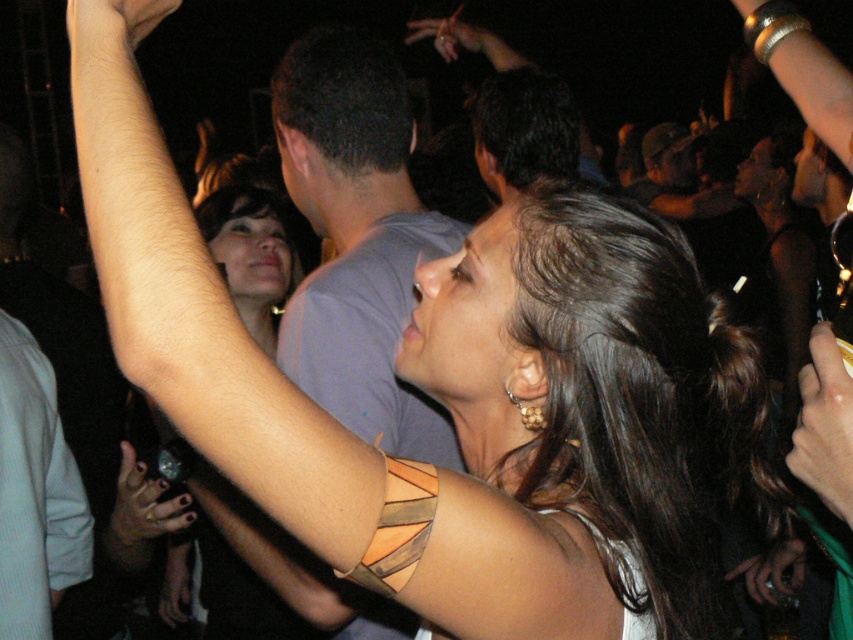
Question: Does smooth gold bracelet at upper right appear under smooth metallic bracelet at upper left?

Choices:
 (A) no
 (B) yes

Answer: (B)

Question: Which point is closer to the camera?

Choices:
 (A) (813, 346)
 (B) (421, 35)

Answer: (A)

Question: Can you confirm if leather bracelet at upper left is positioned below polished silver ring at upper left?

Choices:
 (A) no
 (B) yes

Answer: (A)

Question: Which point is closer to the camera?

Choices:
 (A) (764, 474)
 (B) (155, 531)
 (C) (850, 474)

Answer: (C)

Question: Is smooth metallic bracelet at upper left above smooth skin hand at upper center?

Choices:
 (A) yes
 (B) no

Answer: (B)

Question: Based on their relative distances, which object is nearer to the polished silver ring at upper left?

Choices:
 (A) smooth skin hand at upper center
 (B) gray cotton shirt at center
 (C) leather bracelet at upper left
 (D) dark brown leather handbag at upper center

Answer: (B)